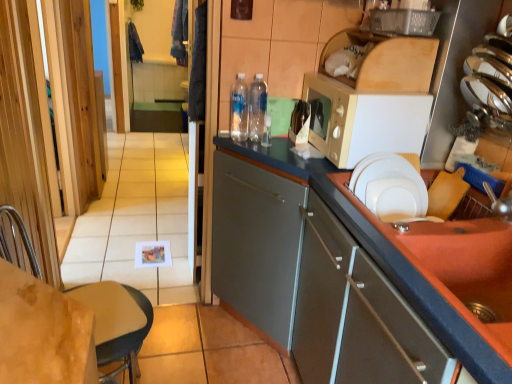
Locate an element on the screen. The height and width of the screenshot is (384, 512). vacant space that is to the left of translucent glass bottle at center, which is the 1th bottle in right-to-left order is located at coordinates (276, 140).